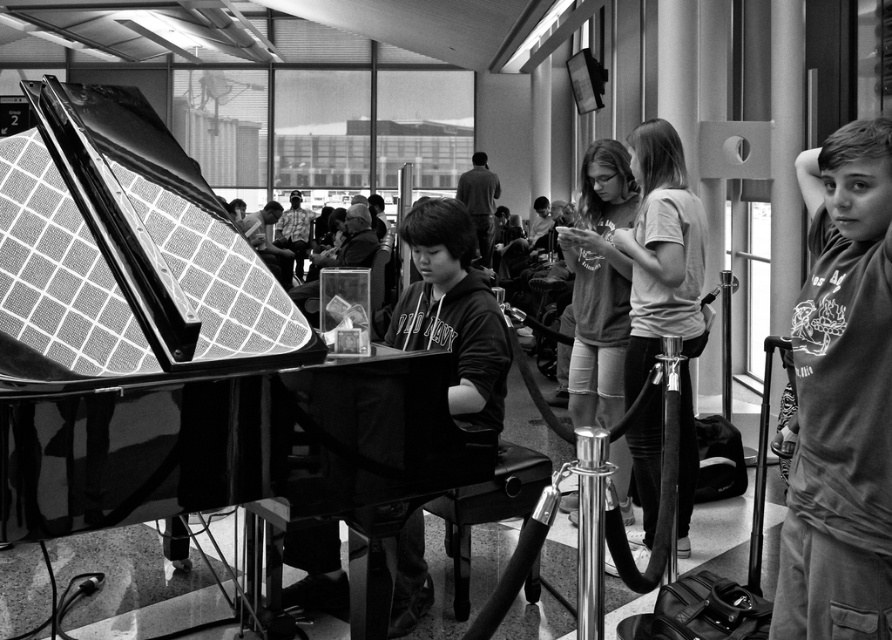
Is smooth black hoodie at center wider than matte gray shirt at center?

Incorrect, smooth black hoodie at center's width does not surpass matte gray shirt at center's.

Can you confirm if smooth black hoodie at center is positioned to the left of matte gray shirt at center?

Yes, smooth black hoodie at center is to the left of matte gray shirt at center.

Who is more distant from viewer, (402,554) or (663,214)?

The point (663,214) is more distant.

The height and width of the screenshot is (640, 892). I want to click on smooth black hoodie at center, so click(453, 310).

Is point (814, 480) farther from camera compared to point (472, 339)?

No, (814, 480) is closer to viewer.

Between smooth gray hoodie at right and smooth black hoodie at center, which one is positioned lower?

smooth gray hoodie at right is below.

Does point (878, 339) come closer to viewer compared to point (308, 588)?

Yes, point (878, 339) is closer to viewer.

Where is `smooth gray hoodie at right`? This screenshot has height=640, width=892. smooth gray hoodie at right is located at coordinates (841, 397).

Is point (803, 632) positioned in front of point (676, 301)?

That is True.

Where is `smooth gray hoodie at right`? Image resolution: width=892 pixels, height=640 pixels. smooth gray hoodie at right is located at coordinates (841, 397).

The width and height of the screenshot is (892, 640). I want to click on smooth gray hoodie at right, so click(841, 397).